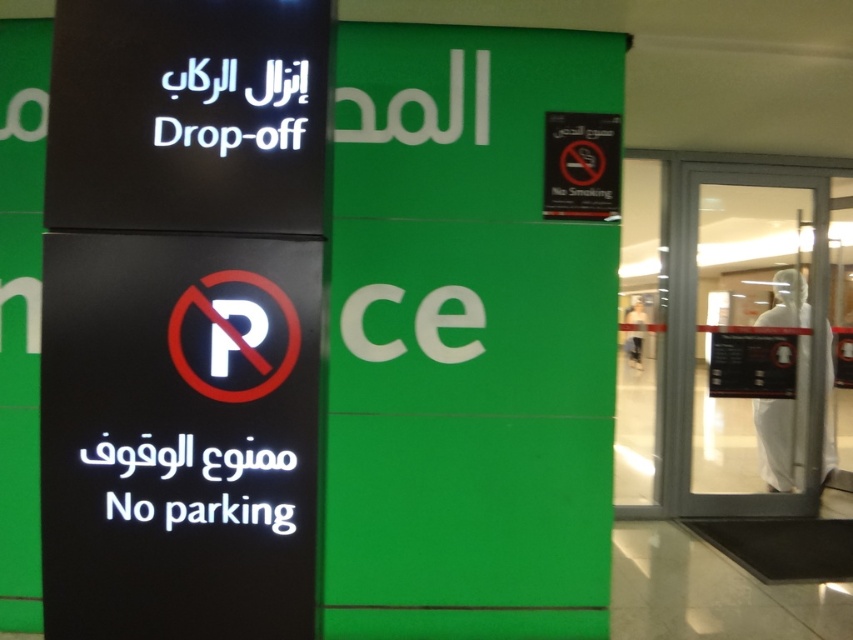
You are a delivery person who needs to park your van temporarily. The van is 2.5 meters long. There is a black glossy sign at center and a camera nearby. Can you park your van between them without overlapping either?

The distance between the black glossy sign at center and the camera is 1.93 meters, which is shorter than the van length of 2.5 meters. Therefore, the van cannot be parked between them without overlapping either object.

You are a traveler trying to locate the drop off area in an airport. You see a black glossy sign at center and a black plastic sign at upper right. Which one is bigger in size?

The black glossy sign at center has a larger size compared to the black plastic sign at upper right, so the black glossy sign at center is bigger.